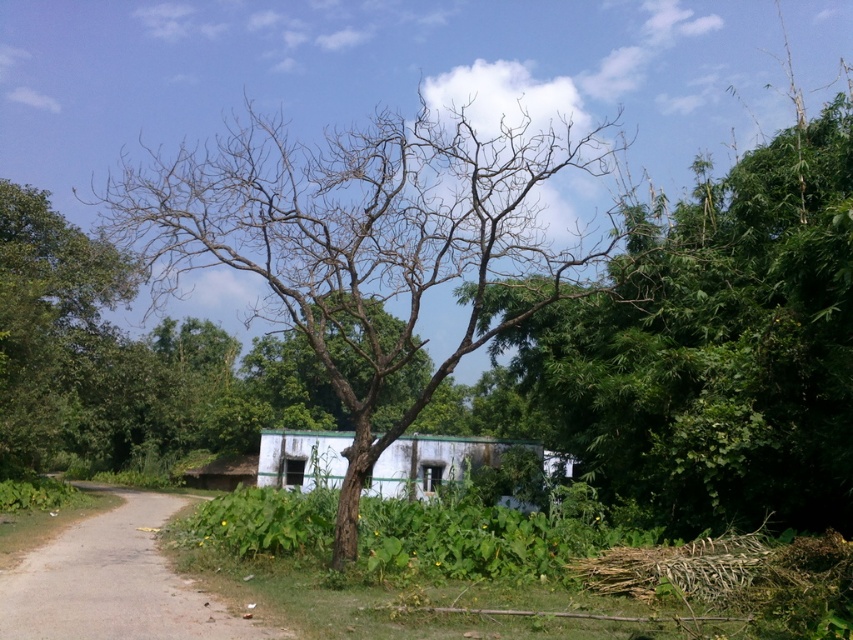
Does brown/dry bark tree at center have a greater height compared to white matte/hardobject at center?

Correct, brown/dry bark tree at center is much taller as white matte/hardobject at center.

Is point (357, 182) more distant than point (468, 436)?

Yes, point (357, 182) is behind point (468, 436).

The width and height of the screenshot is (853, 640). I want to click on brown/dry bark tree at center, so click(x=367, y=246).

Who is higher up, bare branches at left or brown dirt track at lower left?

bare branches at left

Is bare branches at left above brown dirt track at lower left?

Correct, bare branches at left is located above brown dirt track at lower left.

The width and height of the screenshot is (853, 640). I want to click on bare branches at left, so [51, 324].

Between bare branches at center and white matte/hardobject at center, which one has less height?

With less height is white matte/hardobject at center.

Is bare branches at center below white matte/hardobject at center?

No.

The width and height of the screenshot is (853, 640). In order to click on bare branches at center in this screenshot , I will do `click(709, 348)`.

Locate an element on the screen. bare branches at center is located at coordinates (709, 348).